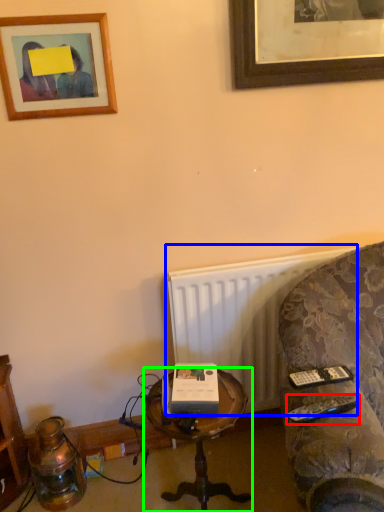
Question: Which object is the farthest from remote (highlighted by a red box)? Choose among these: radiator (highlighted by a blue box) or table (highlighted by a green box).

Choices:
 (A) radiator
 (B) table

Answer: (A)